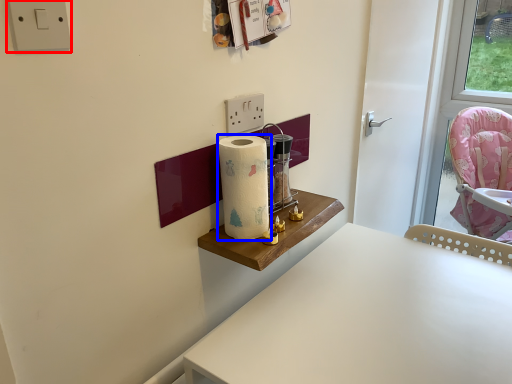
Question: Which of the following is the farthest to the observer, electric outlet (highlighted by a red box) or paper towel (highlighted by a blue box)?

Choices:
 (A) electric outlet
 (B) paper towel

Answer: (B)